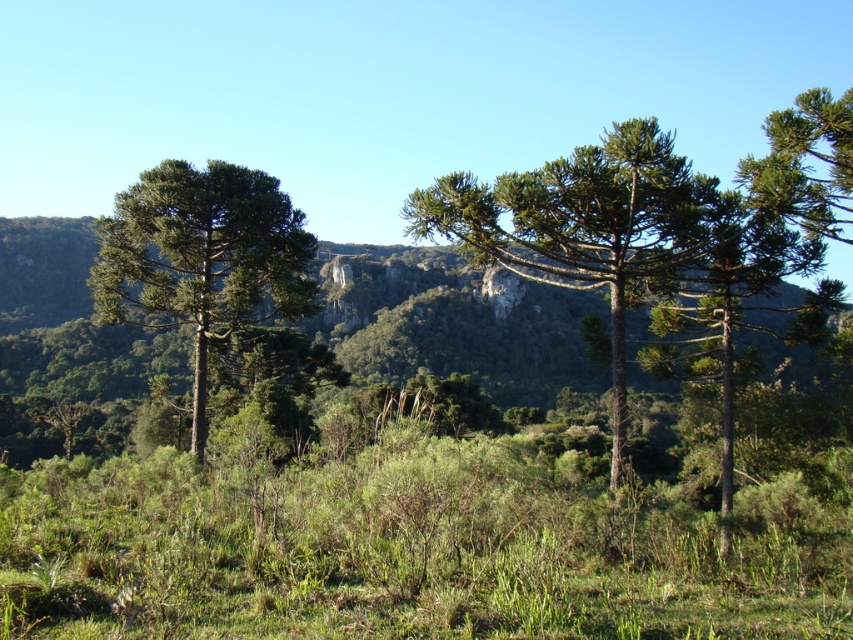
You are standing in the lush landscape and want to take a photo of both the green textured tree at center and the green textured pine tree at left. Which tree should you aim your camera at first if you want to capture both in one shot without moving the camera?

You should aim your camera at the green textured pine tree at left first because it is lower in the frame, allowing you to include both the green textured pine tree at left and the green textured tree at center which is positioned above it in the scene.